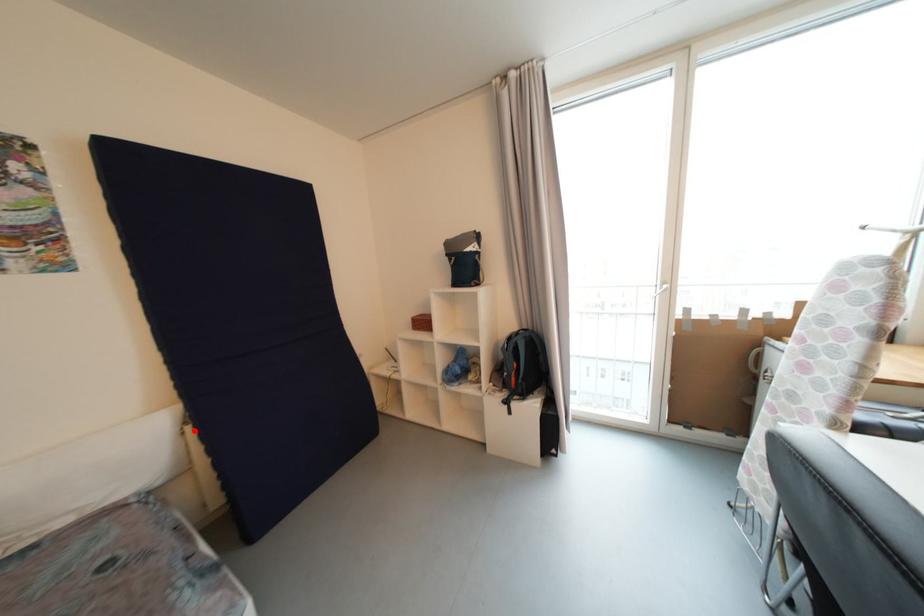
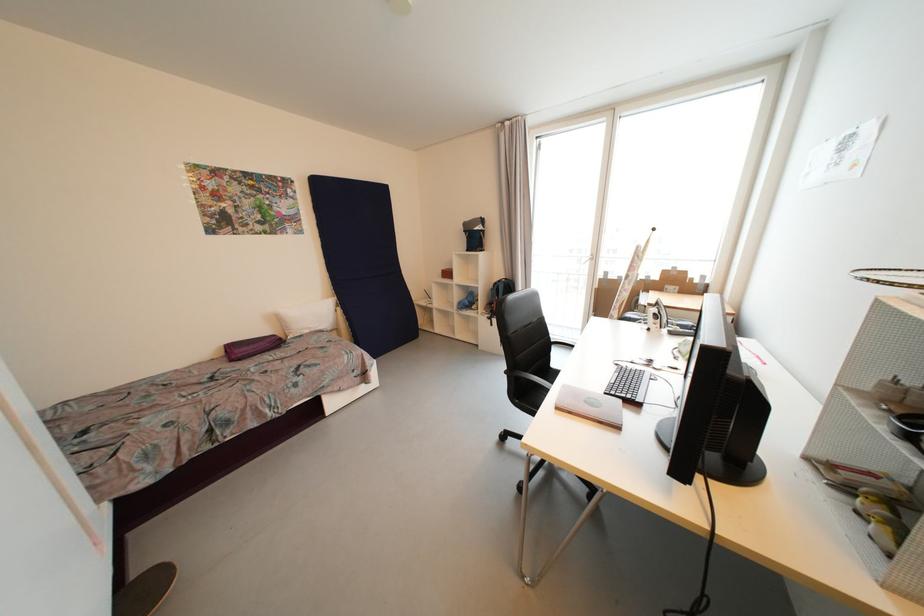
Question: I am providing you with two images of the same scene from different viewpoints. In image1, a red point is highlighted. Considering the same 3D point in image2, which of the following is correct?

Choices:
 (A) It is closer
 (B) It is farther

Answer: (B)